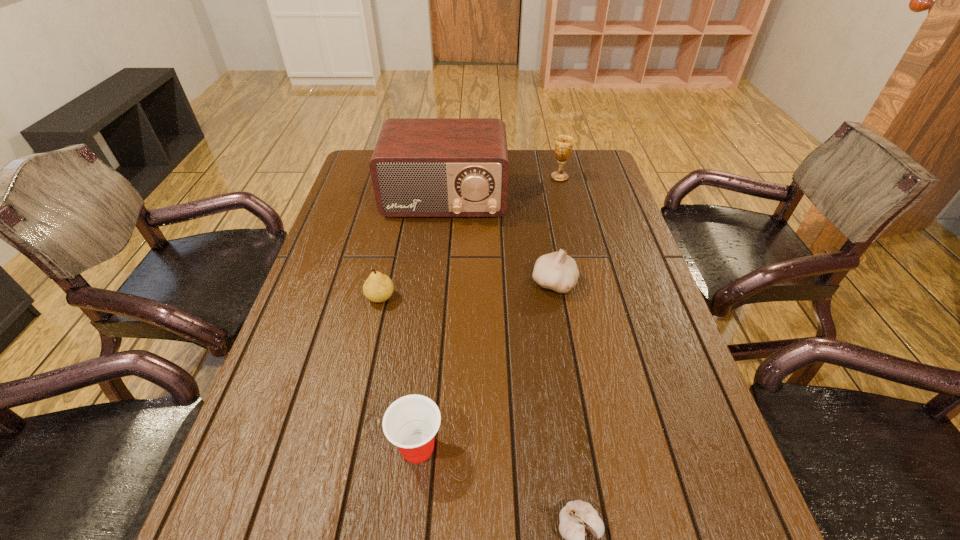
Where is `radio receiver that is at the far edge`? This screenshot has height=540, width=960. radio receiver that is at the far edge is located at coordinates (421, 167).

Where is `chalice present at the far edge`? This screenshot has height=540, width=960. chalice present at the far edge is located at coordinates (563, 146).

Where is `radio receiver at the left edge`? The image size is (960, 540). radio receiver at the left edge is located at coordinates (421, 167).

The height and width of the screenshot is (540, 960). I want to click on pear that is at the left edge, so click(378, 287).

I want to click on object positioned at the right edge, so (x=563, y=146).

Locate an element on the screen. This screenshot has width=960, height=540. object that is at the far left corner is located at coordinates (421, 167).

At what (x,y) coordinates should I click in order to perform the action: click on object that is at the far right corner. Please return your answer as a coordinate pair (x, y). This screenshot has width=960, height=540. Looking at the image, I should click on (563, 146).

Find the location of a particular element. The height and width of the screenshot is (540, 960). vacant space at the far edge of the desktop is located at coordinates (551, 159).

This screenshot has width=960, height=540. Identify the location of vacant area at the left edge of the desktop. (338, 274).

I want to click on vacant space at the right edge of the desktop, so click(x=636, y=352).